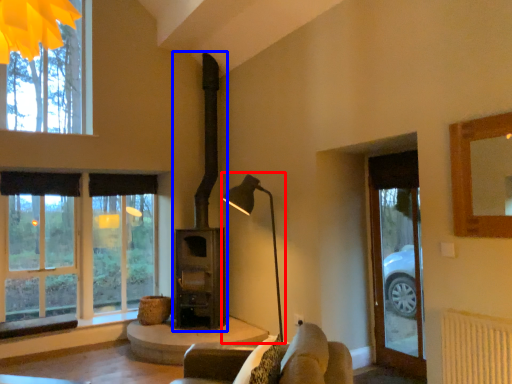
Question: Which object is further to the camera taking this photo, table lamp (highlighted by a red box) or fireplace (highlighted by a blue box)?

Choices:
 (A) table lamp
 (B) fireplace

Answer: (B)